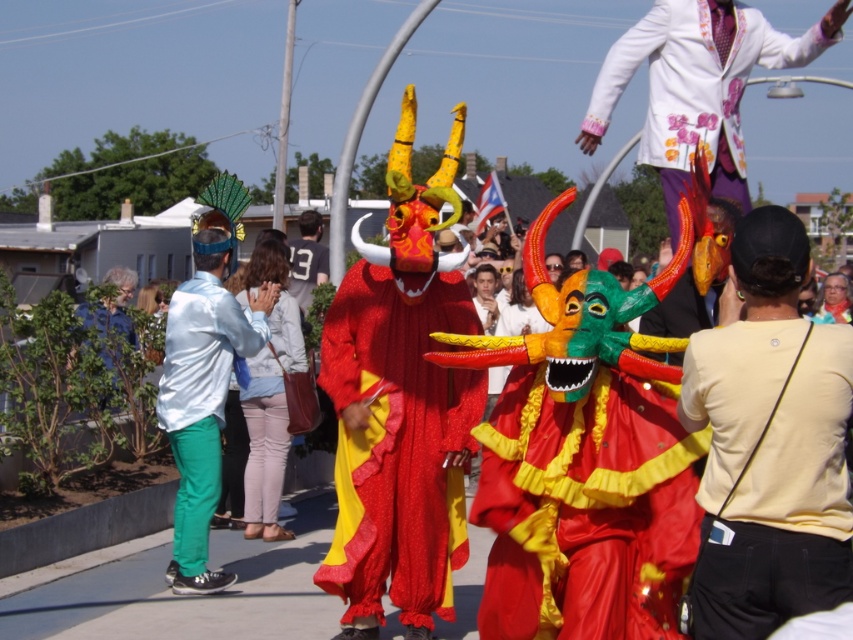
Question: Is light blue denim jacket at center smaller than gray cotton t-shirt at center?

Choices:
 (A) no
 (B) yes

Answer: (A)

Question: Based on their relative distances, which object is farther from the light blue denim jacket at center?

Choices:
 (A) gray cotton t-shirt at center
 (B) yellow matte shirt at center
 (C) shiny red fabric dragon at center

Answer: (B)

Question: Observing the image, what is the correct spatial positioning of shiny red fabric dragon at center in reference to light blue denim jacket at center?

Choices:
 (A) above
 (B) below

Answer: (A)

Question: Based on their relative distances, which object is nearer to the green cotton pants at center?

Choices:
 (A) shiny red fabric dragon at center
 (B) green fabric jacket at lower left
 (C) yellow matte shirt at center

Answer: (A)

Question: Which of the following is the farthest from the observer?

Choices:
 (A) yellow matte shirt at center
 (B) shiny red fabric dragon at center

Answer: (B)

Question: Does yellow matte shirt at center have a smaller size compared to light blue denim jacket at center?

Choices:
 (A) no
 (B) yes

Answer: (A)